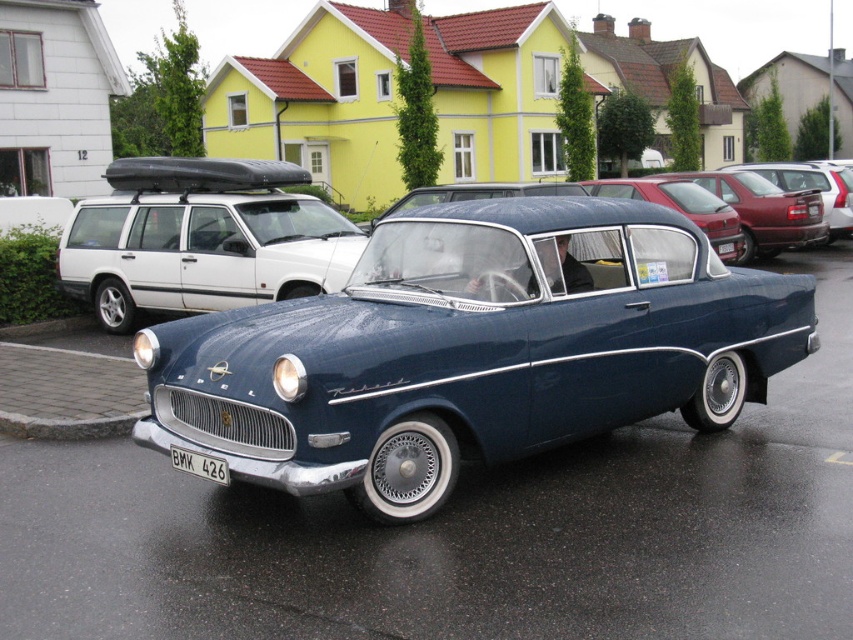
Is point (729, 184) closer to camera compared to point (734, 240)?

No, (729, 184) is further to viewer.

What do you see at coordinates (763, 211) in the screenshot? I see `metallic blue sedan at center` at bounding box center [763, 211].

Is point (775, 253) closer to viewer compared to point (604, 182)?

No, (775, 253) is further to viewer.

Where is `metallic blue sedan at center`? The height and width of the screenshot is (640, 853). metallic blue sedan at center is located at coordinates (763, 211).

Consider the image. Is metallic blue sedan at center above matte red station wagon at right?

No, metallic blue sedan at center is not above matte red station wagon at right.

Can you confirm if metallic blue sedan at center is smaller than matte red station wagon at right?

Indeed, metallic blue sedan at center has a smaller size compared to matte red station wagon at right.

I want to click on metallic blue sedan at center, so click(x=763, y=211).

This screenshot has width=853, height=640. What do you see at coordinates (763, 211) in the screenshot?
I see `metallic blue sedan at center` at bounding box center [763, 211].

This screenshot has height=640, width=853. Identify the location of metallic blue sedan at center. (763, 211).